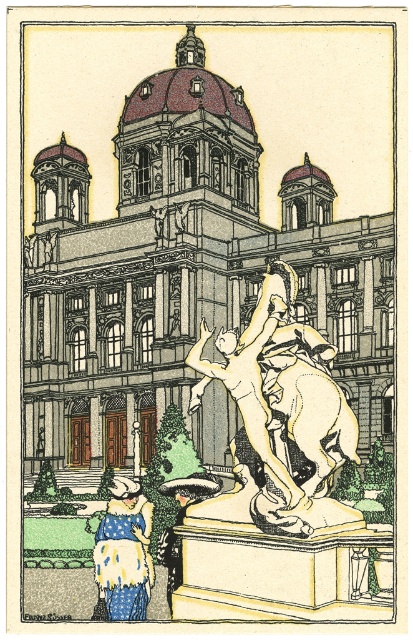
You are standing in front of the grand classical building and notice the gold polished statue at center. Based on its coordinates, can you determine if the statue is positioned closer to the building or further away from it?

The gold polished statue at center is located at point coordinates, so it is positioned closer to the building since the coordinates suggest it is in the foreground of the image.

You are standing in front of the grand classical building and see the gold polished statue at center and the white dotted dress at lower left. From your perspective, which object is positioned to the left?

The white dotted dress at lower left is positioned to the left of the gold polished statue at center.

You are standing in front of the grand classical building and notice a point marked at coordinates (284,410). What object is located at this point?

The point at coordinates (284,410) corresponds to the gold polished statue at center.